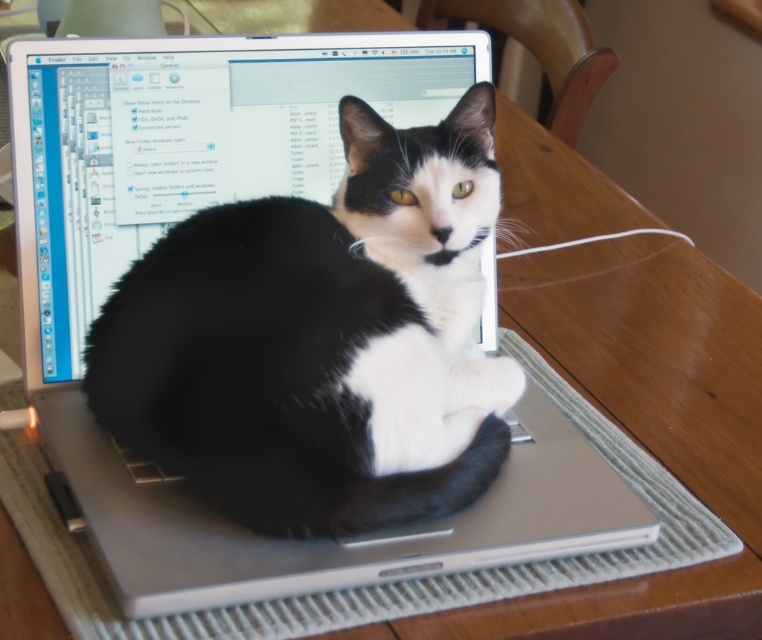
You are a photographer trying to capture a photo of the black fur cat at center and the white string at upper right. Which object will appear larger in the photo?

The black fur cat at center will appear larger in the photo because it is closer to the viewer than the white string at upper right.

You are a pet owner who wants to ensure the safety of your cat. You see the black fur cat at center and the white string at upper right in the image. Which object is taller and requires more vertical space to avoid the cat knocking it over?

The black fur cat at center is taller than the white string at upper right, so it requires more vertical space to avoid knocking it over.

You are a photographer aiming to capture the black fur cat at center in the image. The camera you are using has a focus point set at the center of the image, which corresponds to coordinate point 0.5, 0.5. Given that the cat is located at point (322, 339), will the focus point be able to capture the cat clearly?

The black fur cat at center is located at point (322, 339), which is slightly to the right and above the camera focus point at 0.5, 0.5. Therefore, the focus point may not capture the cat clearly unless adjusted.